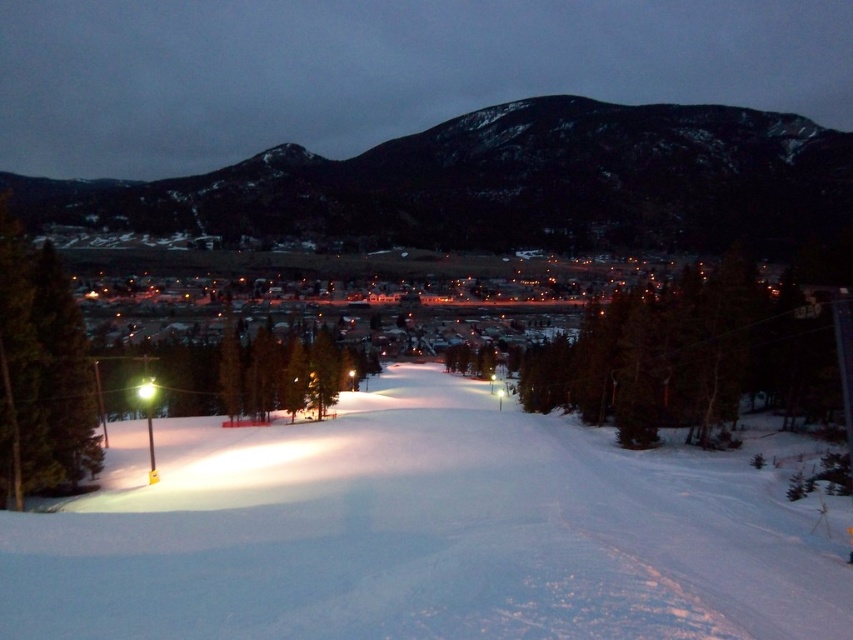
Between white snow ski slope at center and dark gray rocky hill at upper center, which one appears on the left side from the viewer's perspective?

white snow ski slope at center

Is point (764, 602) closer to viewer compared to point (373, 200)?

That is True.

What do you see at coordinates (421, 534) in the screenshot? I see `white snow ski slope at center` at bounding box center [421, 534].

Identify the location of white snow ski slope at center. This screenshot has height=640, width=853. (421, 534).